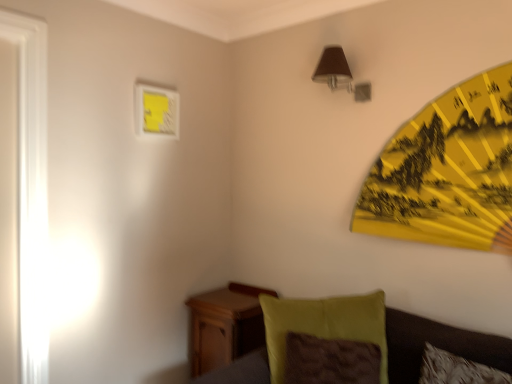
Question: Is brown fabric lampshade at upper right positioned beyond the bounds of wooden nightstand at lower left?

Choices:
 (A) yes
 (B) no

Answer: (A)

Question: Does brown fabric lampshade at upper right have a greater width compared to wooden nightstand at lower left?

Choices:
 (A) yes
 (B) no

Answer: (B)

Question: Is brown fabric lampshade at upper right positioned in front of wooden nightstand at lower left?

Choices:
 (A) no
 (B) yes

Answer: (B)

Question: Would you consider brown fabric lampshade at upper right to be distant from wooden nightstand at lower left?

Choices:
 (A) no
 (B) yes

Answer: (B)

Question: From a real-world perspective, is brown fabric lampshade at upper right below wooden nightstand at lower left?

Choices:
 (A) no
 (B) yes

Answer: (A)

Question: Choose the correct answer: Is velvet green couch at lower right inside velvety green pillow at lower right or outside it?

Choices:
 (A) outside
 (B) inside

Answer: (A)

Question: Based on their positions, is velvet green couch at lower right located to the left or right of velvety green pillow at lower right?

Choices:
 (A) right
 (B) left

Answer: (A)

Question: In the image, is velvet green couch at lower right positioned in front of or behind velvety green pillow at lower right?

Choices:
 (A) front
 (B) behind

Answer: (A)

Question: Considering the positions of velvet green couch at lower right and velvety green pillow at lower right in the image, is velvet green couch at lower right wider or thinner than velvety green pillow at lower right?

Choices:
 (A) thin
 (B) wide

Answer: (B)

Question: In terms of size, does brown fabric lampshade at upper right appear bigger or smaller than velvet green couch at lower right?

Choices:
 (A) small
 (B) big

Answer: (A)

Question: Is point (330, 56) positioned closer to the camera than point (247, 347)?

Choices:
 (A) farther
 (B) closer

Answer: (B)

Question: In the image, is brown fabric lampshade at upper right positioned in front of or behind velvet green couch at lower right?

Choices:
 (A) behind
 (B) front

Answer: (A)

Question: From a real-world perspective, is brown fabric lampshade at upper right positioned above or below velvet green couch at lower right?

Choices:
 (A) above
 (B) below

Answer: (A)

Question: From the image's perspective, is velvety green pillow at lower right located above or below yellow paper umbrella at upper right?

Choices:
 (A) above
 (B) below

Answer: (B)

Question: Based on their sizes in the image, would you say velvety green pillow at lower right is bigger or smaller than yellow paper umbrella at upper right?

Choices:
 (A) small
 (B) big

Answer: (A)